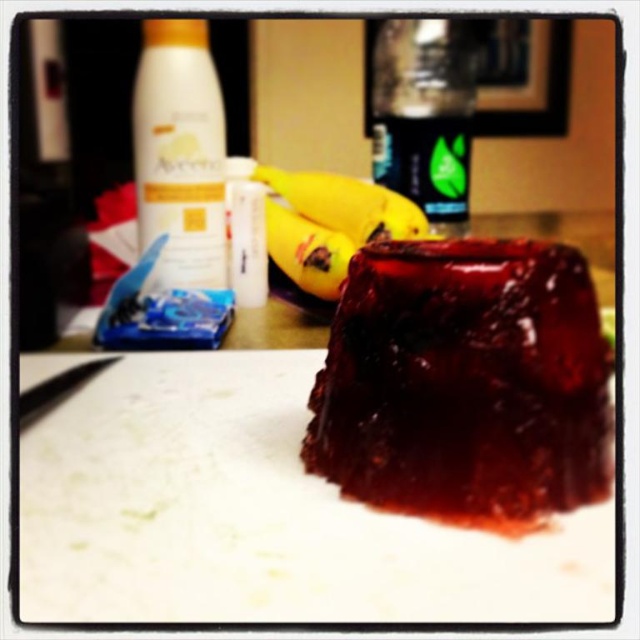
Is shiny dark red jelly at center thinner than yellow smooth banana at center?

Yes.

Can you confirm if shiny dark red jelly at center is positioned above yellow smooth banana at center?

Actually, shiny dark red jelly at center is below yellow smooth banana at center.

The width and height of the screenshot is (640, 640). I want to click on shiny dark red jelly at center, so click(x=465, y=384).

The height and width of the screenshot is (640, 640). What are the coordinates of `shiny dark red jelly at center` in the screenshot? It's located at (465, 384).

Does point (410, 449) come in front of point (212, 202)?

Yes, point (410, 449) is closer to viewer.

Which of these two, shiny dark red jelly at center or white matte lotion at upper left, stands taller?

white matte lotion at upper left

Which is in front, point (380, 508) or point (200, 44)?

Point (380, 508) is in front.

This screenshot has height=640, width=640. In order to click on shiny dark red jelly at center in this screenshot , I will do `click(465, 384)`.

Does point (419, 486) lie behind point (432, 163)?

No, (419, 486) is in front of (432, 163).

From the picture: Does shiny dark red jelly at center lie in front of translucent plastic bottle at upper center?

Yes, it is.

I want to click on shiny dark red jelly at center, so click(x=465, y=384).

Where is `shiny dark red jelly at center`? shiny dark red jelly at center is located at coordinates (465, 384).